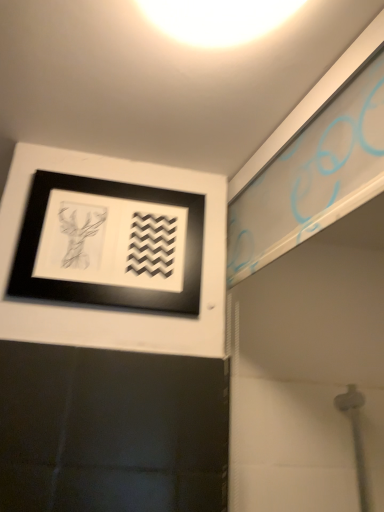
Question: Would you say black matte picture frame at upper left is to the left or to the right of white glossy light at upper center in the picture?

Choices:
 (A) left
 (B) right

Answer: (A)

Question: In terms of width, does black matte picture frame at upper left look wider or thinner when compared to white glossy light at upper center?

Choices:
 (A) wide
 (B) thin

Answer: (B)

Question: Choose the correct answer: Is black matte picture frame at upper left inside white glossy light at upper center or outside it?

Choices:
 (A) inside
 (B) outside

Answer: (B)

Question: From a real-world perspective, is white glossy light at upper center positioned above or below black matte picture frame at upper left?

Choices:
 (A) above
 (B) below

Answer: (A)

Question: Would you say white glossy light at upper center is to the left or to the right of black matte picture frame at upper left in the picture?

Choices:
 (A) right
 (B) left

Answer: (A)

Question: Considering the positions of point (271, 26) and point (56, 265), is point (271, 26) closer or farther from the camera than point (56, 265)?

Choices:
 (A) closer
 (B) farther

Answer: (A)

Question: From their relative heights in the image, would you say white glossy light at upper center is taller or shorter than black matte picture frame at upper left?

Choices:
 (A) tall
 (B) short

Answer: (B)